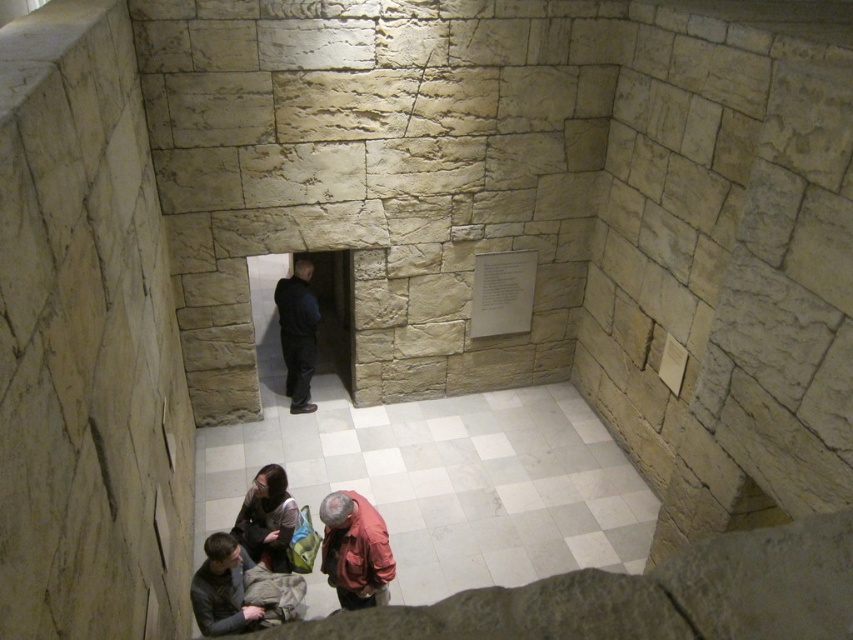
This screenshot has width=853, height=640. What do you see at coordinates (354, 548) in the screenshot?
I see `red leather jacket at lower center` at bounding box center [354, 548].

Between red leather jacket at lower center and dark blue fabric jacket at center, which one appears on the right side from the viewer's perspective?

Positioned to the right is red leather jacket at lower center.

Which is behind, point (355, 536) or point (279, 337)?

The point (279, 337) is behind.

Identify the location of red leather jacket at lower center. Image resolution: width=853 pixels, height=640 pixels. pyautogui.click(x=354, y=548).

In the scene shown: Who is higher up, dark gray sweater at lower left or dark blue fabric jacket at center?

dark blue fabric jacket at center is higher up.

Is dark gray sweater at lower left closer to the viewer compared to dark blue fabric jacket at center?

That is True.

Which is behind, point (245, 624) or point (306, 364)?

Positioned behind is point (306, 364).

Identify the location of dark gray sweater at lower left. This screenshot has width=853, height=640. (222, 588).

Does red leather jacket at lower center appear over dark gray sweater at lower left?

Yes.

Which of these two, red leather jacket at lower center or dark gray sweater at lower left, stands shorter?

dark gray sweater at lower left is shorter.

Which is behind, point (363, 529) or point (230, 611)?

The point (363, 529) is more distant.

You are a GUI agent. You are given a task and a screenshot of the screen. Output one action in this format:
    pyautogui.click(x=<x>, y=<y>)
    Task: Click on the red leather jacket at lower center
    
    Given the screenshot: What is the action you would take?
    pyautogui.click(x=354, y=548)